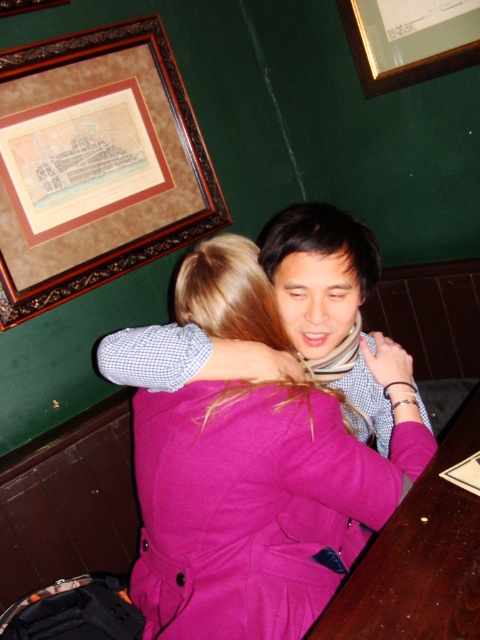
You are a painter standing 5 feet away from the wooden framed map at upper left. You want to paint the map without moving closer. Is the distance sufficient to paint it clearly?

The wooden framed map at upper left is 6.01 feet from viewer. Since you are 5 feet away, you are closer than the map, so you can paint it clearly without needing to move closer.